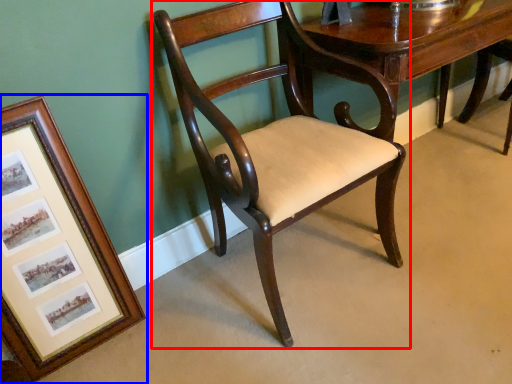
Question: Which object appears closest to the camera in this image, chair (highlighted by a red box) or picture frame (highlighted by a blue box)?

Choices:
 (A) chair
 (B) picture frame

Answer: (A)